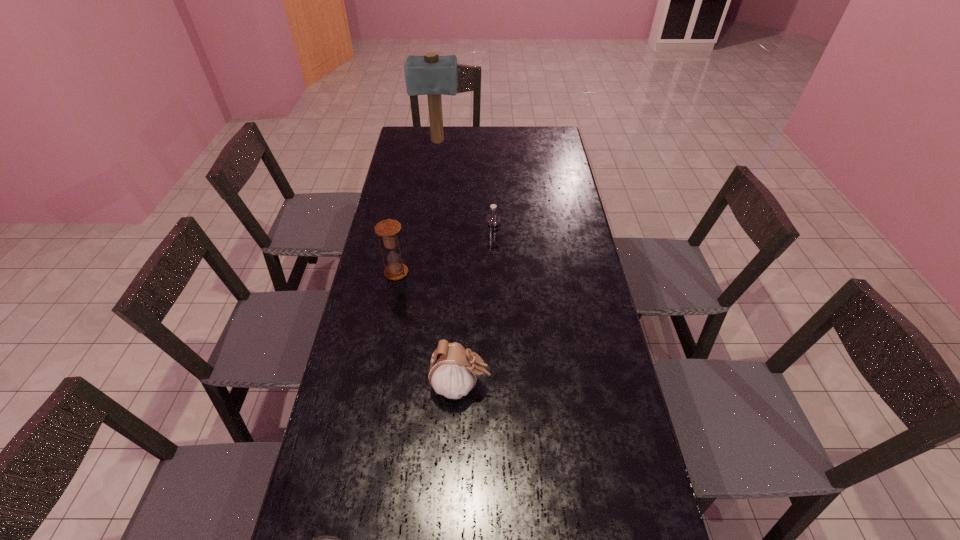
Find the location of a particular element. free spot between the fourth nearest object and the pouch is located at coordinates (476, 316).

Locate an element on the screen. The height and width of the screenshot is (540, 960). free space that is in between the fourth farthest object and the third nearest object is located at coordinates (428, 329).

Where is `empty space that is in between the vodka and the tallest object`? This screenshot has height=540, width=960. empty space that is in between the vodka and the tallest object is located at coordinates (465, 194).

Find the location of a particular element. This screenshot has width=960, height=540. vacant area that lies between the third farthest object and the vodka is located at coordinates (444, 260).

Where is `vacant area that lies between the second nearest object and the second farthest object`? vacant area that lies between the second nearest object and the second farthest object is located at coordinates (476, 316).

The width and height of the screenshot is (960, 540). I want to click on vacant point located between the third farthest object and the mallet, so 417,207.

Find the location of `object that is the second nearest to the hourglass`. object that is the second nearest to the hourglass is located at coordinates (453, 370).

Locate which object ranks second in proximity to the fourth farthest object. Please provide its 2D coordinates. Your answer should be formatted as a tuple, i.e. [(x, y)], where the tuple contains the x and y coordinates of a point satisfying the conditions above.

[(324, 539)]

The width and height of the screenshot is (960, 540). What are the coordinates of `free space that satisfies the following two spatial constraints: 1. on the front label of the vodka; 2. on the front-facing side of the fourth farthest object` in the screenshot? It's located at (x=496, y=386).